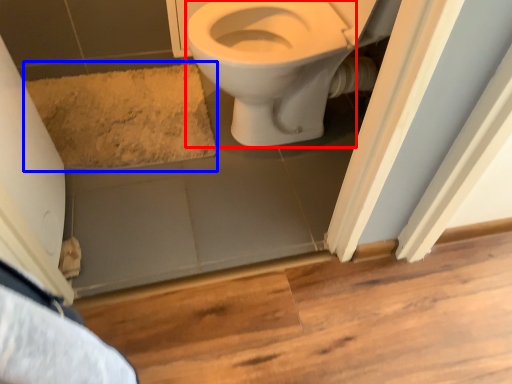
Question: Which object is closer to the camera taking this photo, bidet (highlighted by a red box) or bath mat (highlighted by a blue box)?

Choices:
 (A) bidet
 (B) bath mat

Answer: (A)